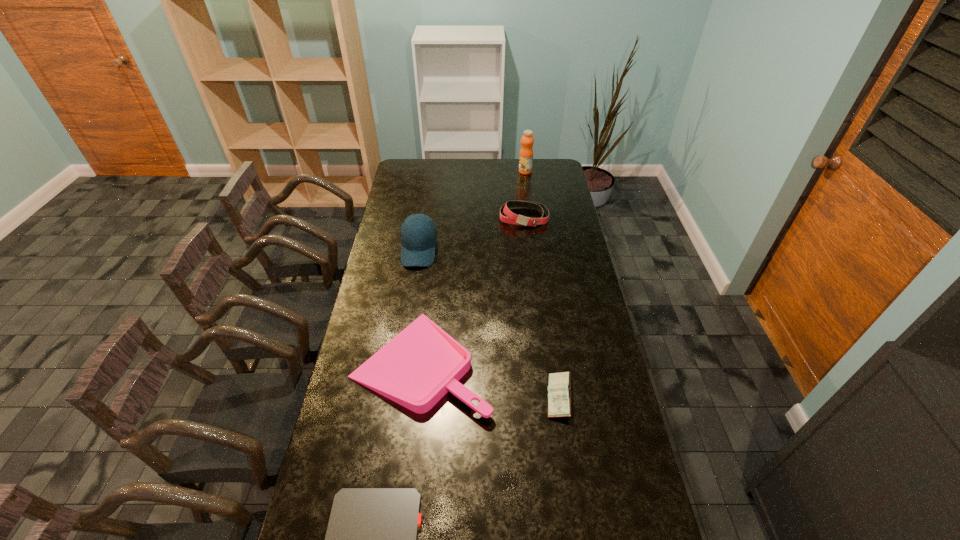
This screenshot has height=540, width=960. I want to click on vacant space situated on the right of the third tallest object, so click(563, 217).

Find the location of `free space located 0.070m on the right of the diary`. free space located 0.070m on the right of the diary is located at coordinates (594, 397).

The height and width of the screenshot is (540, 960). Find the location of `object that is at the far edge`. object that is at the far edge is located at coordinates (526, 152).

At what (x,y) coordinates should I click in order to perform the action: click on baseball cap that is at the left edge. Please return your answer as a coordinate pair (x, y). The width and height of the screenshot is (960, 540). Looking at the image, I should click on (418, 232).

You are a GUI agent. You are given a task and a screenshot of the screen. Output one action in this format:
    pyautogui.click(x=<x>, y=<y>)
    Task: Click on the dustpan at the left edge
    The width and height of the screenshot is (960, 540).
    Given the screenshot: What is the action you would take?
    pyautogui.click(x=415, y=369)

Locate an element on the screen. The width and height of the screenshot is (960, 540). dog collar that is at the right edge is located at coordinates (512, 218).

Locate an element on the screen. Image resolution: width=960 pixels, height=540 pixels. diary that is positioned at the right edge is located at coordinates [x=559, y=388].

Image resolution: width=960 pixels, height=540 pixels. In order to click on vacant position at the far edge of the desktop in this screenshot , I will do `click(497, 166)`.

This screenshot has height=540, width=960. Identify the location of vacant space at the left edge of the desktop. (372, 463).

This screenshot has height=540, width=960. Find the location of `vacant space at the right edge of the desktop`. vacant space at the right edge of the desktop is located at coordinates (575, 312).